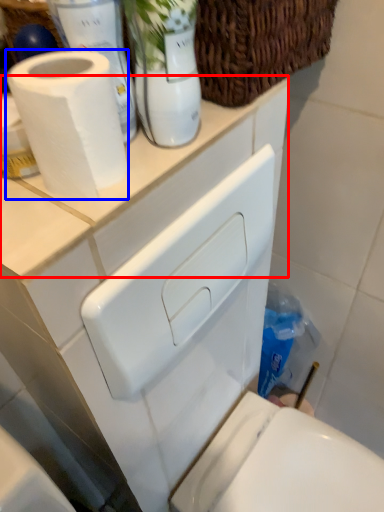
Question: Which point is closer to the camera, counter top (highlighted by a red box) or toilet paper (highlighted by a blue box)?

Choices:
 (A) counter top
 (B) toilet paper

Answer: (B)